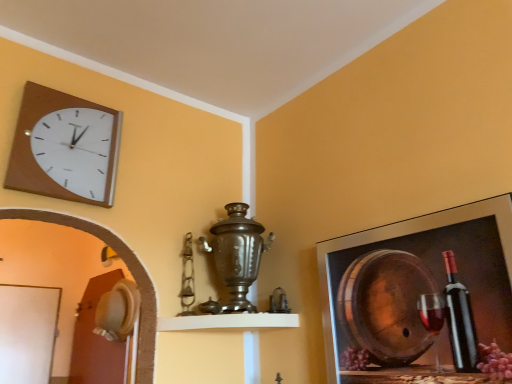
Question: Can you confirm if metallic frame at upper right is smaller than white matte shelf at center?

Choices:
 (A) yes
 (B) no

Answer: (B)

Question: Is metallic frame at upper right to the right of white matte shelf at center from the viewer's perspective?

Choices:
 (A) no
 (B) yes

Answer: (B)

Question: From the image's perspective, does metallic frame at upper right appear higher than white matte shelf at center?

Choices:
 (A) no
 (B) yes

Answer: (B)

Question: Are metallic frame at upper right and white matte shelf at center beside each other?

Choices:
 (A) yes
 (B) no

Answer: (B)

Question: Does metallic frame at upper right have a larger size compared to white matte shelf at center?

Choices:
 (A) yes
 (B) no

Answer: (A)

Question: From a real-world perspective, is metallic frame at upper right beneath white matte shelf at center?

Choices:
 (A) yes
 (B) no

Answer: (B)

Question: Considering the relative sizes of matte brown clock at upper left and white matte shelf at center in the image provided, is matte brown clock at upper left smaller than white matte shelf at center?

Choices:
 (A) no
 (B) yes

Answer: (B)

Question: Can you confirm if matte brown clock at upper left is taller than white matte shelf at center?

Choices:
 (A) yes
 (B) no

Answer: (A)

Question: Is the position of matte brown clock at upper left less distant than that of white matte shelf at center?

Choices:
 (A) yes
 (B) no

Answer: (A)

Question: Can you confirm if matte brown clock at upper left is positioned to the right of white matte shelf at center?

Choices:
 (A) yes
 (B) no

Answer: (B)

Question: Could you tell me if matte brown clock at upper left is facing white matte shelf at center?

Choices:
 (A) no
 (B) yes

Answer: (A)

Question: Is matte brown clock at upper left looking in the opposite direction of white matte shelf at center?

Choices:
 (A) yes
 (B) no

Answer: (B)

Question: Can you confirm if metallic frame at upper right is bigger than matte brown clock at upper left?

Choices:
 (A) no
 (B) yes

Answer: (B)